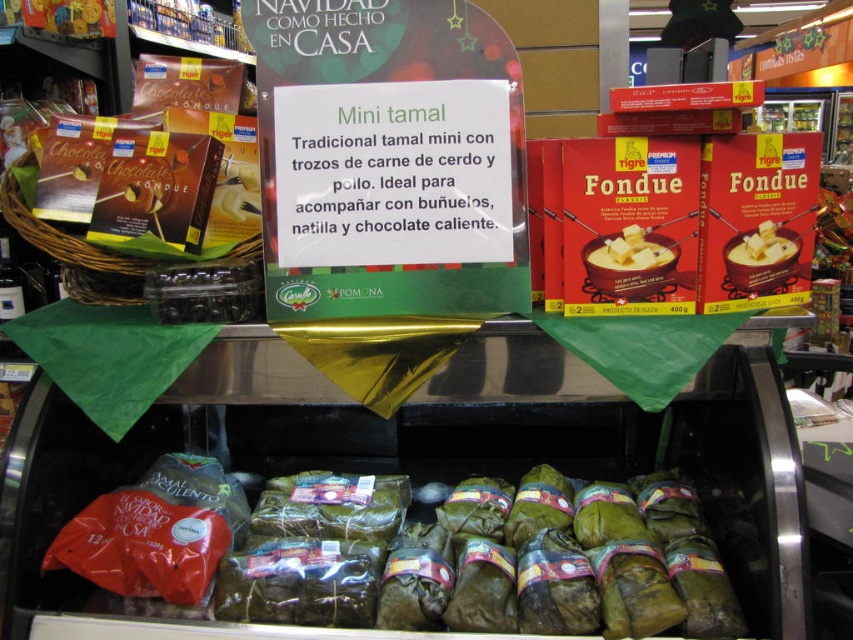
What is located at the point marked by the coordinates (416, 556) in the refrigerated display case?

The point marked by the coordinates (416, 556) in the refrigerated display case indicates a green leafy wrapped item located at the lower center of the display.

You are a customer looking at the refrigerated display case and see the white creamy cheese at center and the smooth white cheese at center. Which cheese is positioned lower in the display?

The white creamy cheese at center is located below the smooth white cheese at center, so it is positioned lower in the display.

You are a grocery store employee who needs to place a new item between the green leafy wrapped at lower center and the smooth white cheese at center. The new item requires 12 inches of space. Is there enough space between them to accommodate it?

The distance between the green leafy wrapped at lower center and the smooth white cheese at center is 24.81 inches. Since the new item requires 12 inches of space, there is enough space to place it between them.